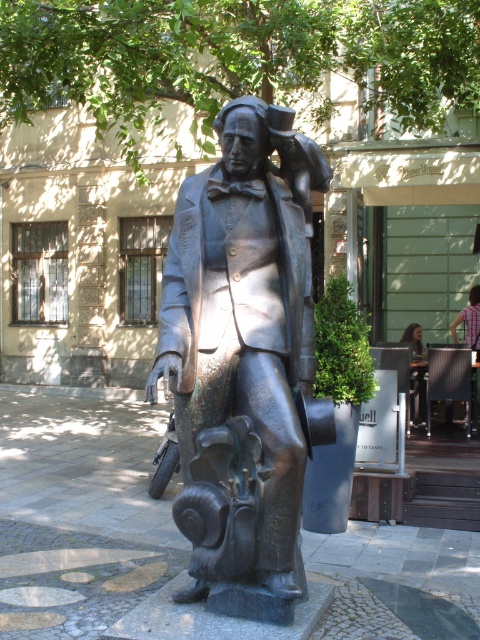
From the picture: Which is more to the right, plaid fabric shirt at upper right or dark hair person at center?

plaid fabric shirt at upper right

Who is lower down, plaid fabric shirt at upper right or dark hair person at center?

dark hair person at center is below.

What do you see at coordinates (468, 321) in the screenshot? I see `plaid fabric shirt at upper right` at bounding box center [468, 321].

Locate an element on the screen. plaid fabric shirt at upper right is located at coordinates click(x=468, y=321).

Can you confirm if bronze statue at center is shorter than dark hair person at center?

No, bronze statue at center is not shorter than dark hair person at center.

Image resolution: width=480 pixels, height=640 pixels. What do you see at coordinates (242, 358) in the screenshot?
I see `bronze statue at center` at bounding box center [242, 358].

Find the location of a particular element. The image size is (480, 640). bronze statue at center is located at coordinates (242, 358).

Does bronze statue at center have a greater height compared to plaid fabric shirt at upper right?

Indeed, bronze statue at center has a greater height compared to plaid fabric shirt at upper right.

Which is in front, point (304, 365) or point (476, 340)?

Point (304, 365)

Consider the image. Who is more forward, (251, 236) or (471, 291)?

Point (251, 236) is more forward.

This screenshot has width=480, height=640. I want to click on bronze statue at center, so click(242, 358).